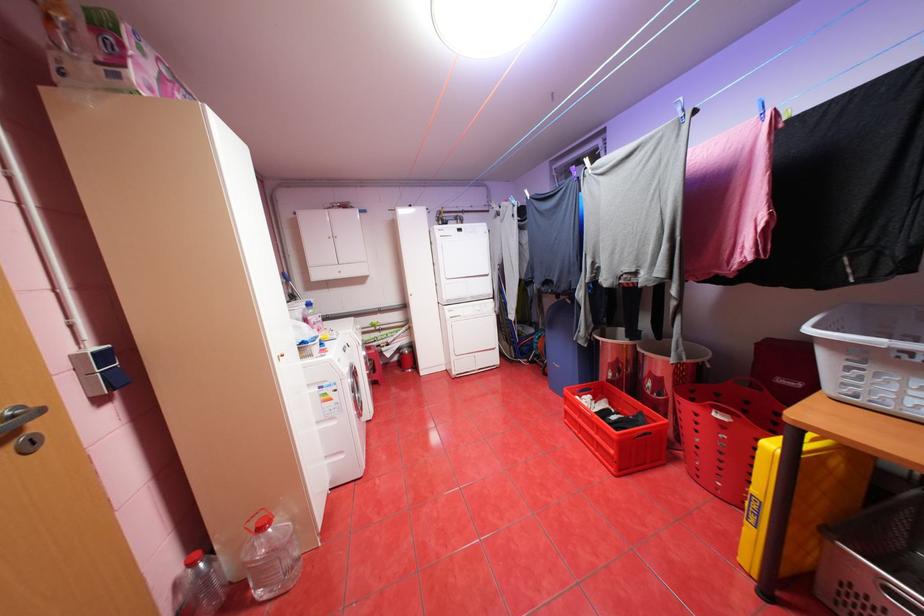
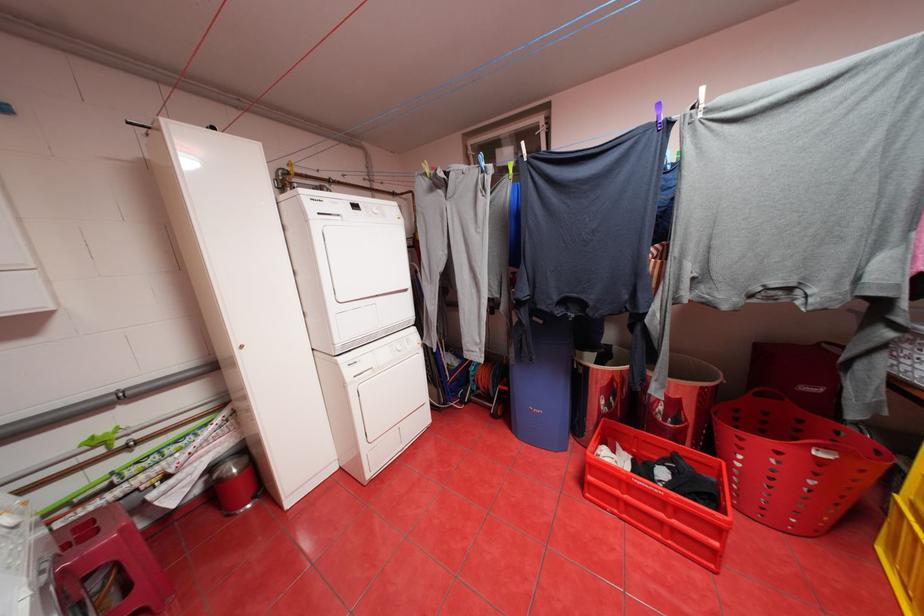
Find the pixel in the second image that matches [725,415] in the first image.

(828, 453)